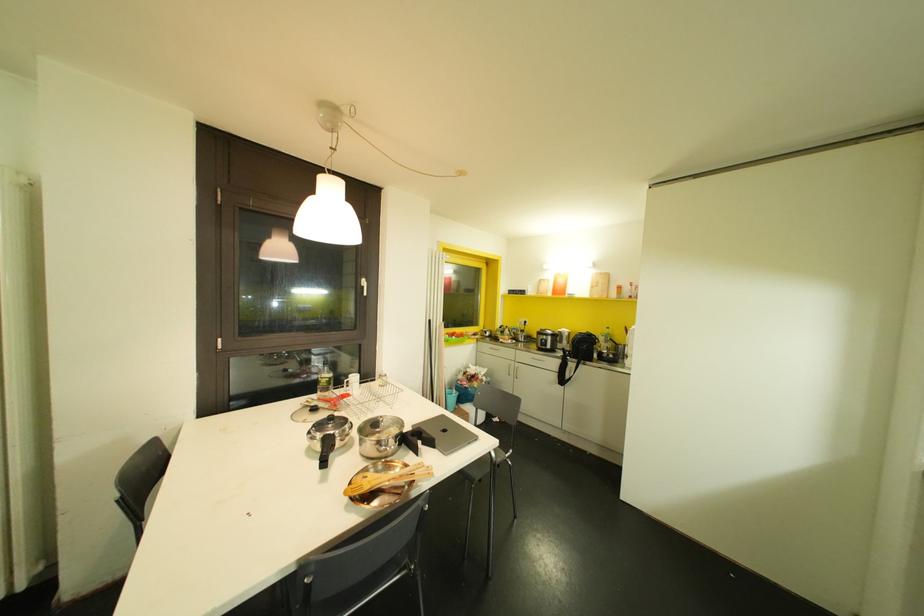
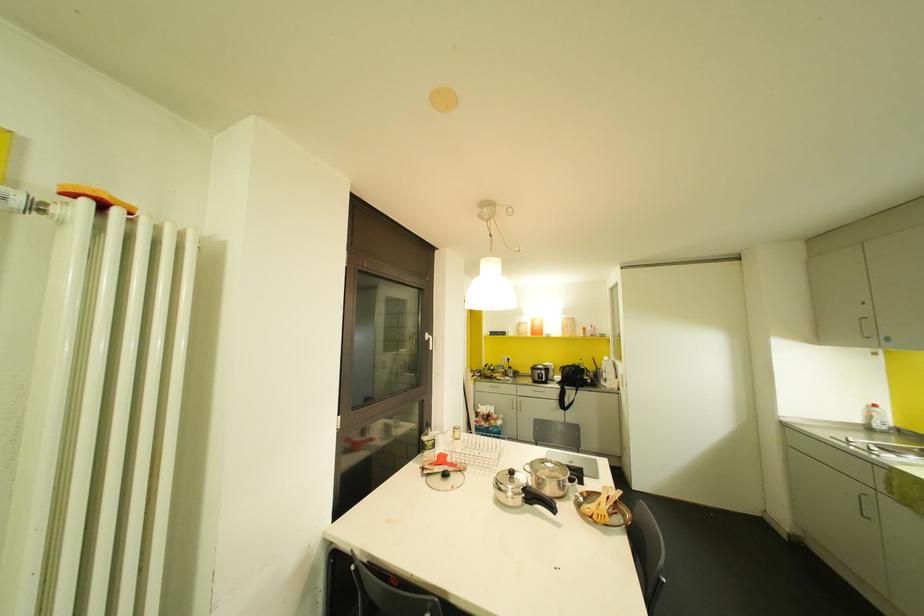
The point at (558, 291) is marked in the first image. Where is the corresponding point in the second image?

(536, 331)